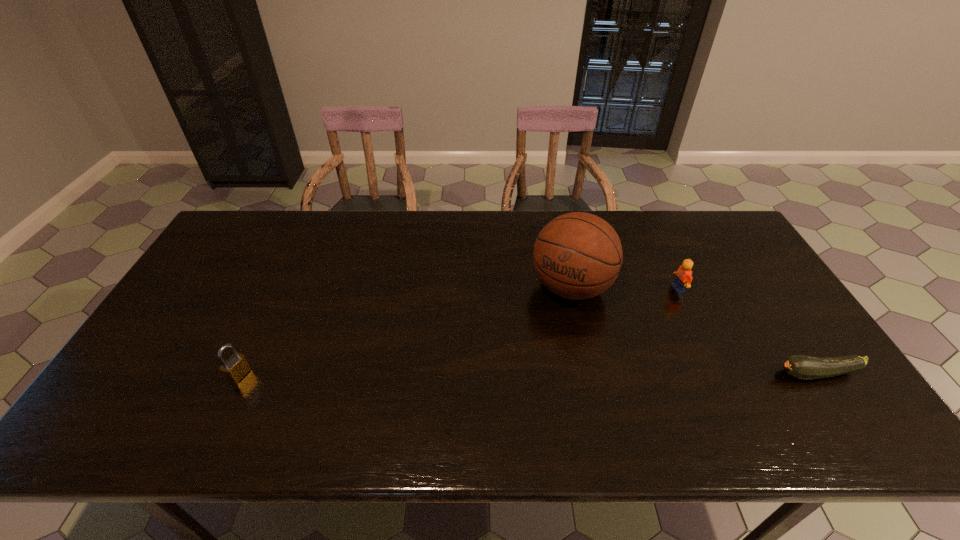
Find the location of a particular element. the leftmost object is located at coordinates (236, 367).

At what (x,y) coordinates should I click in order to perform the action: click on the shortest object. Please return your answer as a coordinate pair (x, y). Looking at the image, I should click on (802, 367).

Locate an element on the screen. This screenshot has width=960, height=540. the rightmost object is located at coordinates (802, 367).

What are the coordinates of `the second object from left to right` in the screenshot? It's located at (577, 255).

Identify the location of the tallest object. (577, 255).

Find the location of a particular element. Image resolution: width=960 pixels, height=540 pixels. the third object from left to right is located at coordinates (683, 278).

The width and height of the screenshot is (960, 540). Identify the location of vacant space situated 0.100m on the left of the padlock. (190, 375).

I want to click on free location located at the blossom end of the shortest object, so click(x=612, y=374).

I want to click on vacant space located at the blossom end of the shortest object, so click(721, 374).

The height and width of the screenshot is (540, 960). Identify the location of vacant area situated 0.200m at the blossom end of the shortest object. (693, 374).